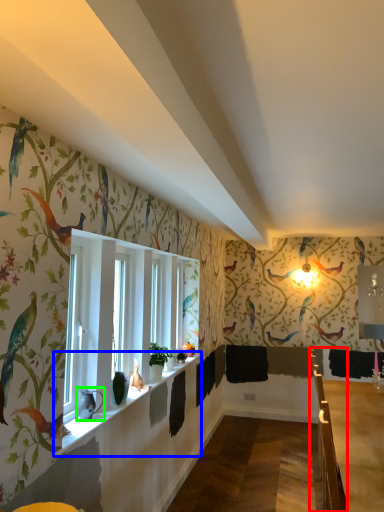
Question: Based on their relative distances, which object is farther from rail (highlighted by a red box)? Choose from window sill (highlighted by a blue box) and animal (highlighted by a green box).

Choices:
 (A) window sill
 (B) animal

Answer: (B)